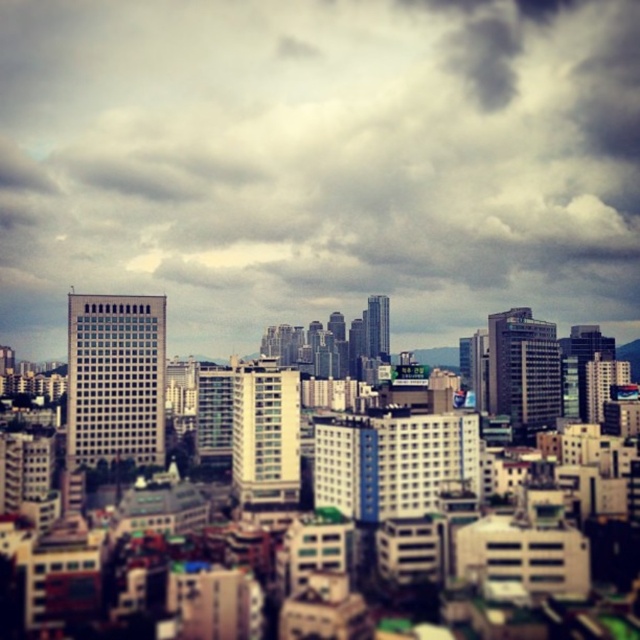
Is cloudy sky at upper center thinner than white glass building at center?

No.

Is cloudy sky at upper center to the right of white glass building at center from the viewer's perspective?

No, cloudy sky at upper center is not to the right of white glass building at center.

Does point (493, 209) come behind point (74, 611)?

Yes, point (493, 209) is behind point (74, 611).

The width and height of the screenshot is (640, 640). Find the location of `cloudy sky at upper center`. cloudy sky at upper center is located at coordinates (317, 163).